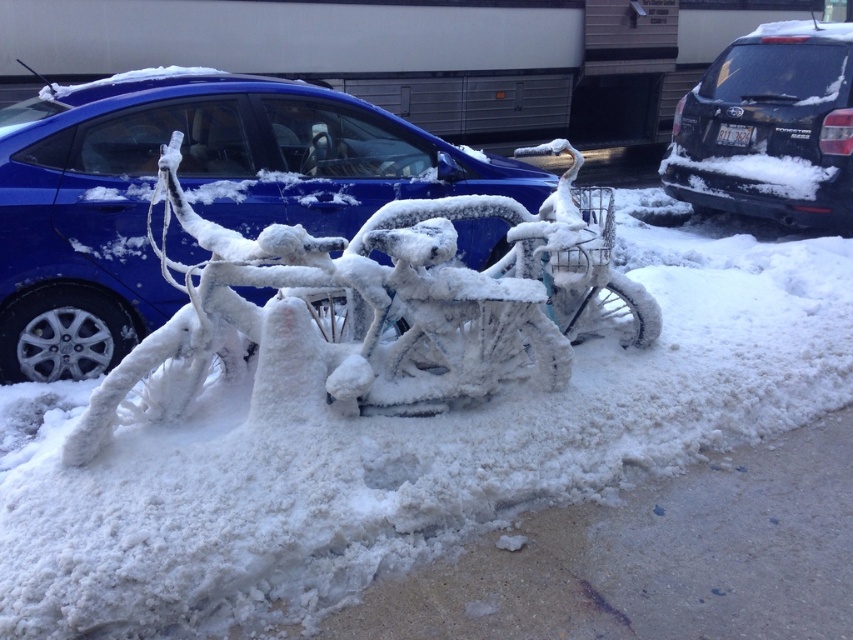
Between white frosty bicycle at center and matte blue car at center, which one has less height?

white frosty bicycle at center

Does white frosty bicycle at center have a lesser height compared to matte blue car at center?

Yes.

Image resolution: width=853 pixels, height=640 pixels. In order to click on white frosty bicycle at center in this screenshot , I will do `click(407, 452)`.

The width and height of the screenshot is (853, 640). What are the coordinates of `white frosty bicycle at center` in the screenshot? It's located at (407, 452).

Does matte blue car at center appear over black matte suv at upper right?

No, matte blue car at center is not above black matte suv at upper right.

Which is below, matte blue car at center or black matte suv at upper right?

matte blue car at center is lower down.

Is point (39, 148) farther from viewer compared to point (788, 97)?

That is False.

Locate an element on the screen. This screenshot has width=853, height=640. matte blue car at center is located at coordinates (189, 192).

Which is above, white frosty bicycle at center or black matte suv at upper right?

Positioned higher is black matte suv at upper right.

In the scene shown: Who is more forward, (158, 540) or (679, 109)?

Point (158, 540)

You are a GUI agent. You are given a task and a screenshot of the screen. Output one action in this format:
    pyautogui.click(x=<x>, y=<y>)
    Task: Click on the white frosty bicycle at center
    The height and width of the screenshot is (640, 853).
    Given the screenshot: What is the action you would take?
    pyautogui.click(x=407, y=452)

Identify the location of white frosty bicycle at center. This screenshot has width=853, height=640. (407, 452).